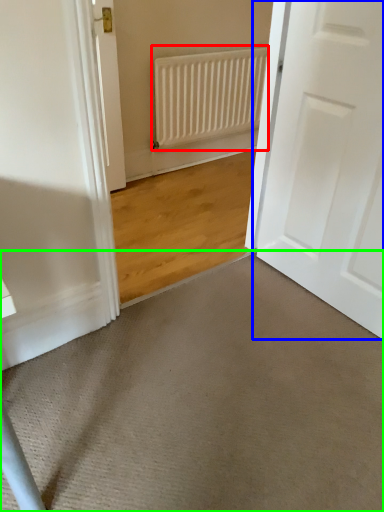
Question: Which object is the farthest from radiator (highlighted by a red box)? Choose among these: door (highlighted by a blue box) or doormat (highlighted by a green box).

Choices:
 (A) door
 (B) doormat

Answer: (B)